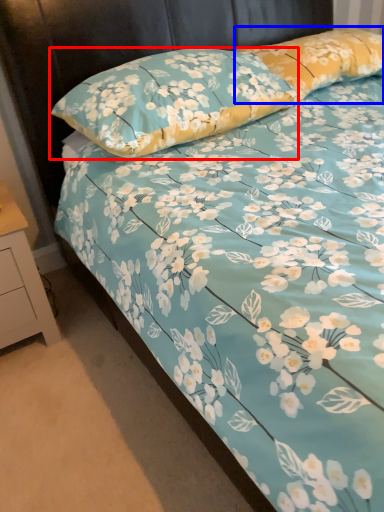
Question: Which of the following is the farthest to the observer, pillow (highlighted by a red box) or pillow (highlighted by a blue box)?

Choices:
 (A) pillow
 (B) pillow

Answer: (B)